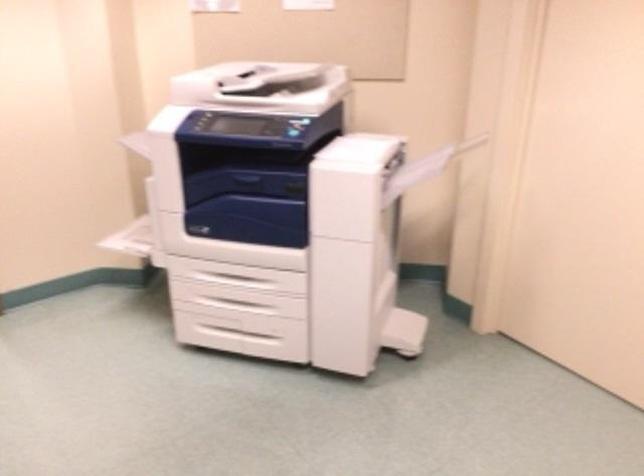
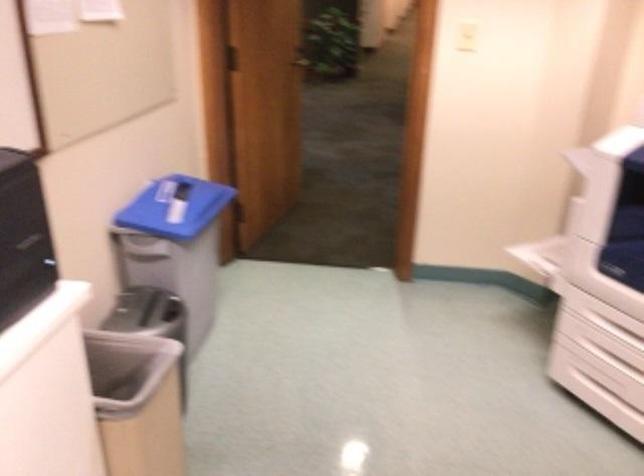
Where in the second image is the point corresponding to (221,333) from the first image?

(605, 398)